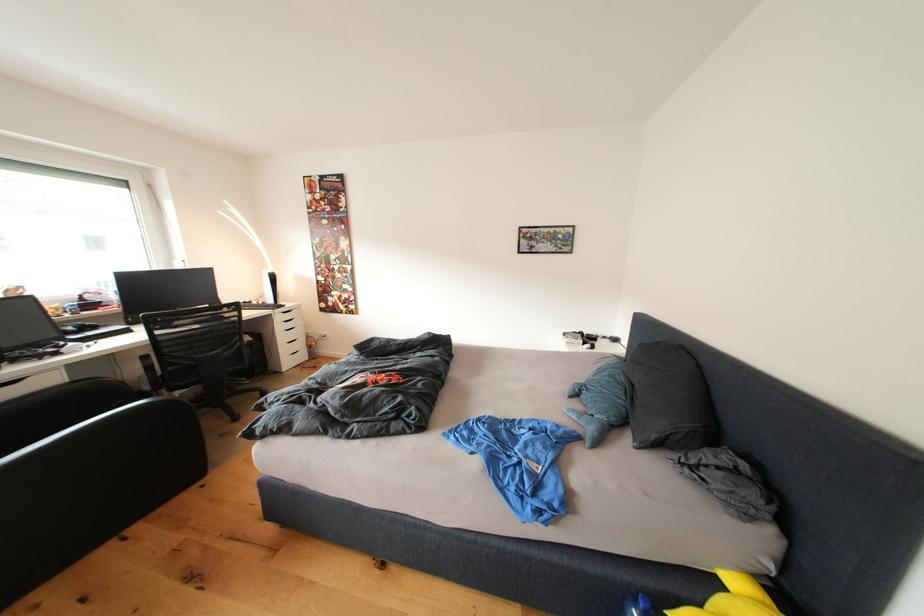
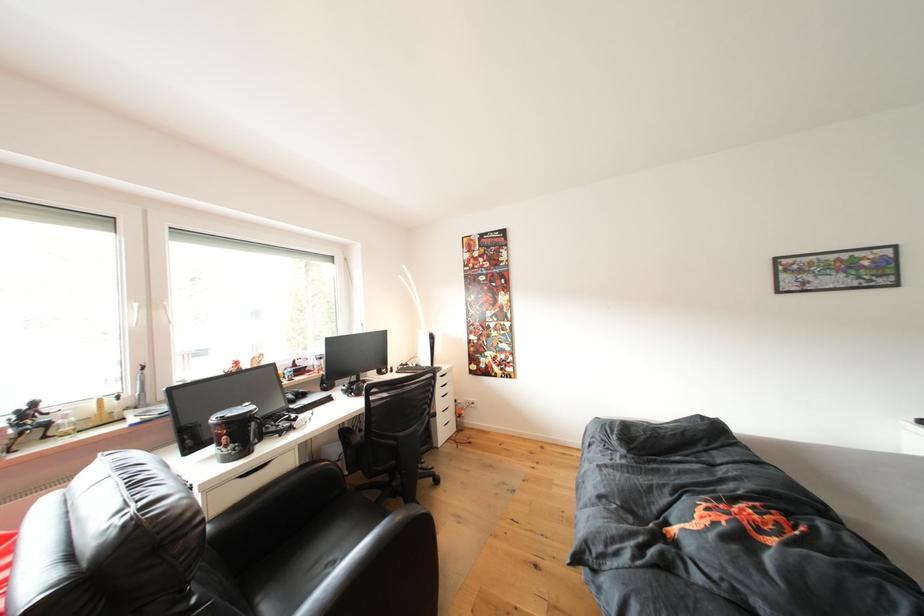
Question: In a continuous first-person perspective shot, in which direction is the camera moving?

Choices:
 (A) Left
 (B) Right
 (C) Forward
 (D) Backward

Answer: (A)